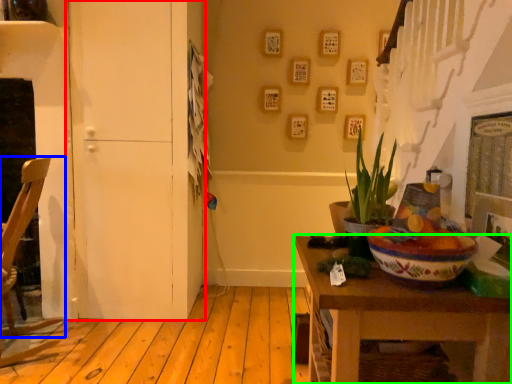
Question: Considering the real-world distances, which object is closest to door (highlighted by a red box)? chair (highlighted by a blue box) or table (highlighted by a green box).

Choices:
 (A) chair
 (B) table

Answer: (A)